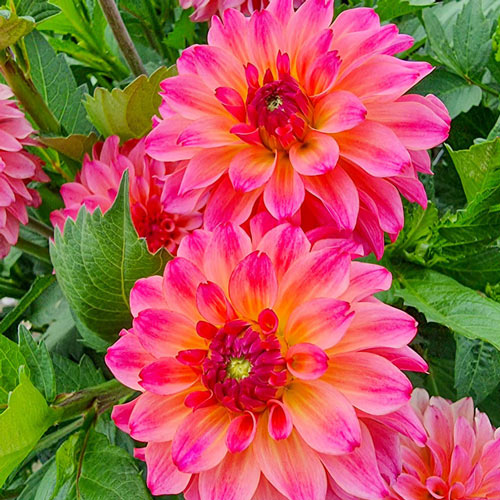
This screenshot has height=500, width=500. I want to click on flower center, so click(x=240, y=367), click(x=275, y=104).